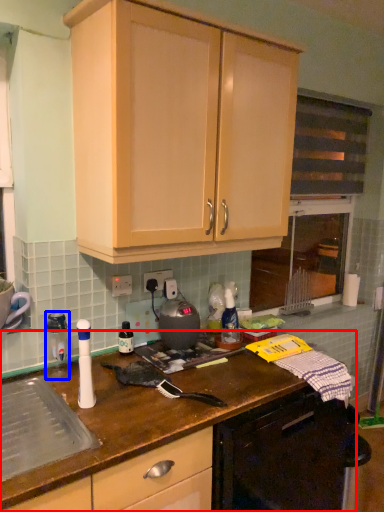
Question: Which object appears closest to the camera in this image, countertop (highlighted by a red box) or appliance (highlighted by a blue box)?

Choices:
 (A) countertop
 (B) appliance

Answer: (A)